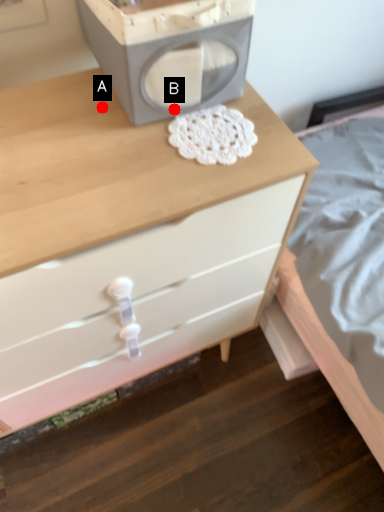
Question: Two points are circled on the image, labeled by A and B beside each circle. Which point is further to the camera?

Choices:
 (A) A is further
 (B) B is further

Answer: (A)